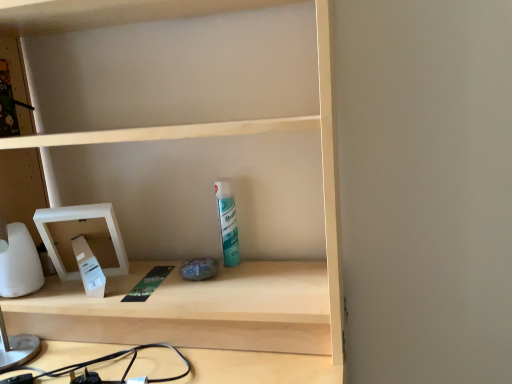
Question: Should I look upward or downward to see white glossy can at center?

Choices:
 (A) down
 (B) up

Answer: (A)

Question: Could white plastic medicine cabinet at left be considered to be inside white glossy can at center?

Choices:
 (A) no
 (B) yes

Answer: (A)

Question: Does white glossy can at center appear on the right side of white plastic medicine cabinet at left?

Choices:
 (A) no
 (B) yes

Answer: (B)

Question: Would you consider white glossy can at center to be distant from white plastic medicine cabinet at left?

Choices:
 (A) no
 (B) yes

Answer: (A)

Question: From the image's perspective, is white glossy can at center under white plastic medicine cabinet at left?

Choices:
 (A) no
 (B) yes

Answer: (A)

Question: Is white glossy can at center closer to the viewer compared to white plastic medicine cabinet at left?

Choices:
 (A) yes
 (B) no

Answer: (B)

Question: Is white glossy can at center located outside white plastic medicine cabinet at left?

Choices:
 (A) yes
 (B) no

Answer: (A)

Question: Can you confirm if white plastic medicine cabinet at left is positioned to the left of white glossy can at center?

Choices:
 (A) no
 (B) yes

Answer: (B)

Question: Is white glossy can at center a part of white plastic medicine cabinet at left?

Choices:
 (A) yes
 (B) no

Answer: (B)

Question: Is white plastic medicine cabinet at left further to the viewer compared to white glossy can at center?

Choices:
 (A) yes
 (B) no

Answer: (B)

Question: Can you confirm if white plastic medicine cabinet at left is taller than white glossy can at center?

Choices:
 (A) yes
 (B) no

Answer: (A)

Question: Can you confirm if white plastic medicine cabinet at left is positioned to the right of white glossy can at center?

Choices:
 (A) no
 (B) yes

Answer: (A)

Question: Is white plastic medicine cabinet at left closer to camera compared to white glossy can at center?

Choices:
 (A) no
 (B) yes

Answer: (B)

Question: From the image's perspective, is white glossy can at center above or below white plastic medicine cabinet at left?

Choices:
 (A) above
 (B) below

Answer: (A)